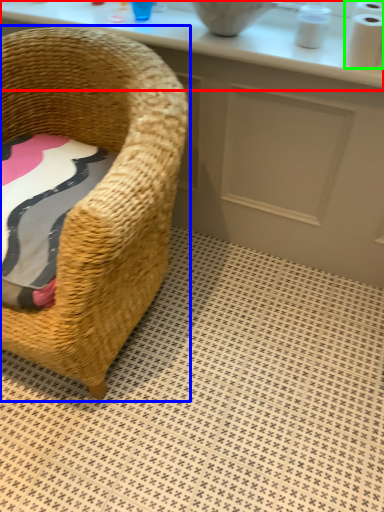
Question: Which object is the farthest from counter top (highlighted by a red box)? Choose among these: chair (highlighted by a blue box) or toilet paper (highlighted by a green box).

Choices:
 (A) chair
 (B) toilet paper

Answer: (A)